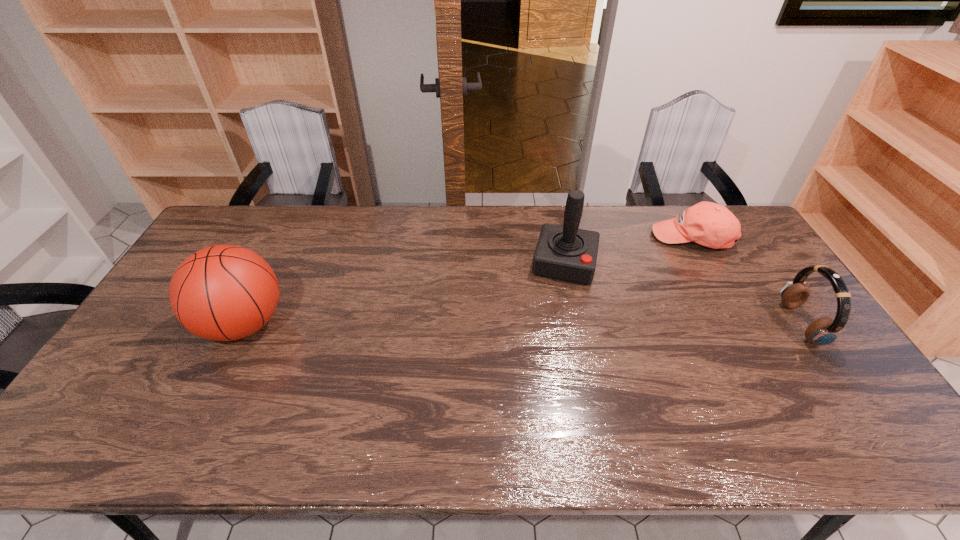
Where is `vacant space located on the base of the second object from left to right`? vacant space located on the base of the second object from left to right is located at coordinates (556, 308).

This screenshot has width=960, height=540. In order to click on free space located on the base of the second object from left to right in this screenshot , I will do `click(555, 313)`.

The width and height of the screenshot is (960, 540). I want to click on free location located 0.260m on the base of the second object from left to right, so click(546, 353).

Identify the location of free space located 0.260m on the front-facing side of the baseball cap. This screenshot has height=540, width=960. (626, 288).

I want to click on free spot located 0.250m on the front-facing side of the baseball cap, so click(628, 286).

This screenshot has width=960, height=540. Find the location of `free space located on the front-facing side of the baseball cap`. free space located on the front-facing side of the baseball cap is located at coordinates (657, 261).

At what (x,y) coordinates should I click in order to perform the action: click on joystick that is at the far edge. Please return your answer as a coordinate pair (x, y). Looking at the image, I should click on (567, 253).

Where is `baseball cap positioned at the far edge`? This screenshot has height=540, width=960. baseball cap positioned at the far edge is located at coordinates (709, 224).

Identify the location of object located at the left edge. point(223,292).

The image size is (960, 540). I want to click on headset that is at the right edge, so click(823, 331).